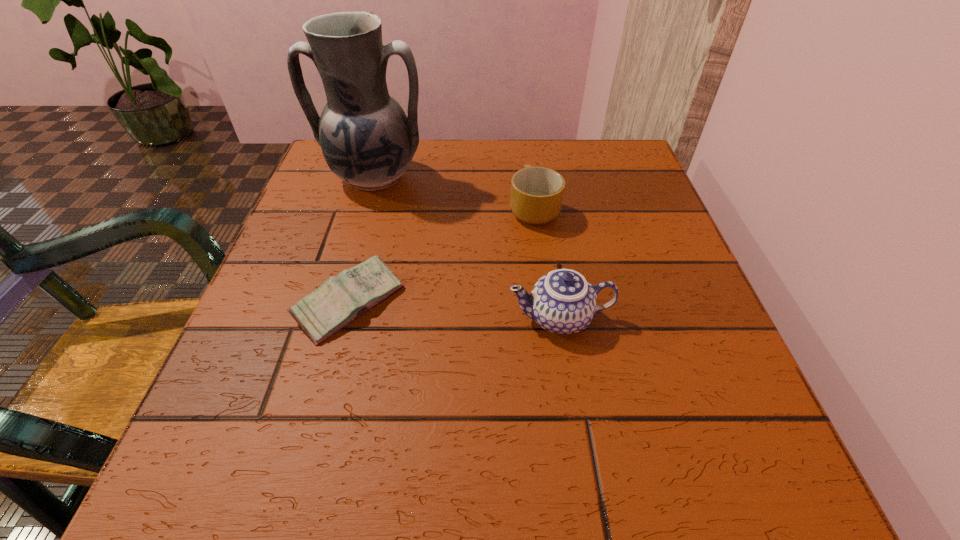
In order to click on vacant space at the left edge in this screenshot , I will do `click(342, 348)`.

In the image, there is a desktop. Where is `free space at the right edge`? The image size is (960, 540). free space at the right edge is located at coordinates (584, 201).

The width and height of the screenshot is (960, 540). I want to click on vacant space at the near left corner of the desktop, so click(170, 505).

Identify the location of vacant area at the far right corner of the desktop. Image resolution: width=960 pixels, height=540 pixels. click(633, 187).

Identify the location of vacant area that lies between the tallest object and the chinaware. 467,248.

Find the location of a particular element. This screenshot has width=960, height=540. vacant space that's between the diary and the pitcher is located at coordinates (362, 241).

Where is `empty space that is in between the chinaware and the shortest object`? empty space that is in between the chinaware and the shortest object is located at coordinates (455, 310).

Locate an element on the screen. free space between the pitcher and the diary is located at coordinates (362, 241).

The width and height of the screenshot is (960, 540). I want to click on free space between the tallest object and the third shortest object, so click(x=467, y=248).

The image size is (960, 540). Identify the location of empty space between the chinaware and the diary. (455, 310).